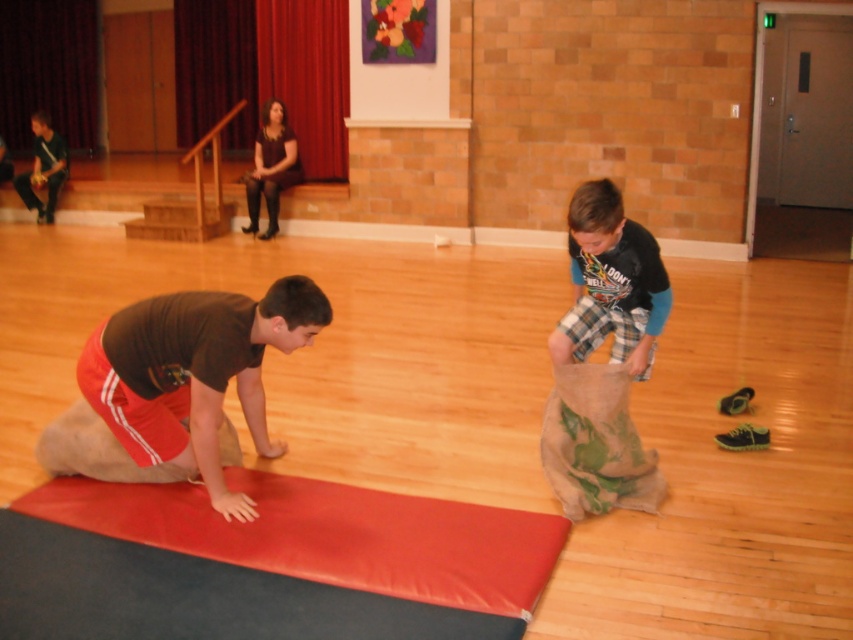
Between matte brown shorts at lower left and matte black guitar at left, which one has less height?

matte brown shorts at lower left is shorter.

Can you confirm if matte brown shorts at lower left is positioned to the left of matte black guitar at left?

No, matte brown shorts at lower left is not to the left of matte black guitar at left.

Identify the location of matte brown shorts at lower left. The width and height of the screenshot is (853, 640). (180, 387).

Is matte brown shorts at lower left to the right of plaid fabric pants at right from the viewer's perspective?

In fact, matte brown shorts at lower left is to the left of plaid fabric pants at right.

Which is more to the left, matte brown shorts at lower left or plaid fabric pants at right?

matte brown shorts at lower left is more to the left.

I want to click on matte brown shorts at lower left, so click(x=180, y=387).

Consider the image. Who is positioned more to the right, plaid fabric pants at right or matte black guitar at left?

Positioned to the right is plaid fabric pants at right.

Between plaid fabric pants at right and matte black guitar at left, which one has less height?

plaid fabric pants at right is shorter.

Between point (612, 280) and point (39, 208), which one is positioned in front?

Point (612, 280) is more forward.

This screenshot has width=853, height=640. Identify the location of plaid fabric pants at right. (611, 282).